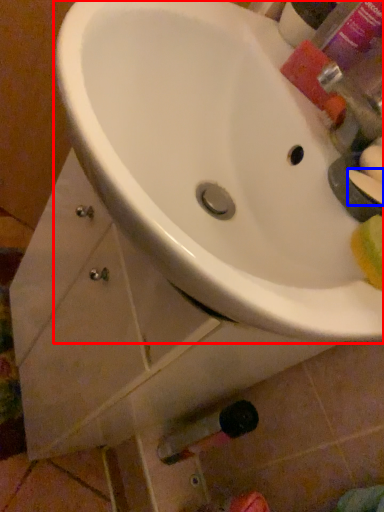
Question: Which point is closer to the camera, sink (highlighted by a red box) or soap (highlighted by a blue box)?

Choices:
 (A) sink
 (B) soap

Answer: (A)